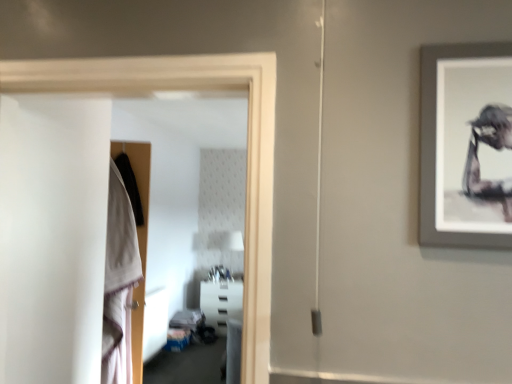
Measure the distance between point (x=249, y=152) and camera.

Point (x=249, y=152) is 1.18 meters away from camera.

Measure the distance between point (x=110, y=313) and camera.

Point (x=110, y=313) and camera are 7.36 feet apart.

The height and width of the screenshot is (384, 512). In order to click on white plastic shelf at center in this screenshot , I will do `click(221, 303)`.

The height and width of the screenshot is (384, 512). In the image, there is a white cotton robe at left. What are the coordinates of `furniture below it (from a real-world perspective)` in the screenshot? It's located at (221, 303).

Would you say white cotton robe at left is part of white plastic shelf at center's contents?

No, white plastic shelf at center does not contain white cotton robe at left.

Which object is further away from the camera, white plastic shelf at center or white cotton robe at left?

Positioned behind is white plastic shelf at center.

Is white plastic shelf at center in contact with white cotton robe at left?

No, white plastic shelf at center is not with white cotton robe at left.

Which of these two, transparent glass door at left or white plastic shelf at center, is thinner?

With smaller width is transparent glass door at left.

Consider the image. Is transparent glass door at left inside or outside of white plastic shelf at center?

transparent glass door at left is outside white plastic shelf at center.

Would you say transparent glass door at left is a long distance from white plastic shelf at center?

Yes.

Looking at this image, does transparent glass door at left have a larger size compared to white plastic shelf at center?

Incorrect, transparent glass door at left is not larger than white plastic shelf at center.

Considering the positions of objects white cotton robe at left and white plastic shelf at center in the image provided, who is more to the right, white cotton robe at left or white plastic shelf at center?

Positioned to the right is white plastic shelf at center.

From a real-world perspective, between white cotton robe at left and white plastic shelf at center, who is vertically higher?

From a 3D spatial view, white cotton robe at left is above.

Looking at the image, does white cotton robe at left seem bigger or smaller compared to white plastic shelf at center?

Clearly, white cotton robe at left is smaller in size than white plastic shelf at center.

Where is `furniture on the right side of white cotton robe at left`? The height and width of the screenshot is (384, 512). furniture on the right side of white cotton robe at left is located at coordinates (221, 303).

Considering the relative sizes of white cotton robe at left and transparent glass door at left in the image provided, is white cotton robe at left smaller than transparent glass door at left?

Correct, white cotton robe at left occupies less space than transparent glass door at left.

Considering the relative sizes of white cotton robe at left and transparent glass door at left in the image provided, is white cotton robe at left taller than transparent glass door at left?

Indeed, white cotton robe at left has a greater height compared to transparent glass door at left.

Would you say white cotton robe at left contains transparent glass door at left?

That's incorrect, transparent glass door at left is not inside white cotton robe at left.

Which of these two, white cotton robe at left or transparent glass door at left, is wider?

white cotton robe at left.

Considering the points (206, 291) and (260, 259), which point is behind, point (206, 291) or point (260, 259)?

The point (206, 291) is farther.

Is white plastic shelf at center wider or thinner than transparent glass door at left?

white plastic shelf at center is wider than transparent glass door at left.

Is white plastic shelf at center taller than transparent glass door at left?

Incorrect, the height of white plastic shelf at center is not larger of that of transparent glass door at left.

In the image, is transparent glass door at left positioned in front of or behind white cotton robe at left?

transparent glass door at left is positioned closer to the viewer than white cotton robe at left.

Who is smaller, transparent glass door at left or white cotton robe at left?

white cotton robe at left.

Is transparent glass door at left thinner than white cotton robe at left?

Yes, transparent glass door at left is thinner than white cotton robe at left.

I want to click on furniture below the white cotton robe at left (from a real-world perspective), so click(221, 303).

Locate an element on the screen. The image size is (512, 384). glass door above the white plastic shelf at center (from the image's perspective) is located at coordinates (247, 148).

Based on their spatial positions, is white cotton robe at left or white plastic shelf at center closer to transparent glass door at left?

white cotton robe at left lies closer to transparent glass door at left than the other object.

Estimate the real-world distances between objects in this image. Which object is closer to white plastic shelf at center, transparent glass door at left or white cotton robe at left?

white cotton robe at left lies closer to white plastic shelf at center than the other object.

Which object lies nearer to the anchor point white cotton robe at left, white plastic shelf at center or transparent glass door at left?

transparent glass door at left is closer to white cotton robe at left.

Estimate the real-world distances between objects in this image. Which object is further from white cotton robe at left, transparent glass door at left or white plastic shelf at center?

Based on the image, white plastic shelf at center appears to be further to white cotton robe at left.

From the image, which object appears to be nearer to white plastic shelf at center, white cotton robe at left or transparent glass door at left?

Among the two, white cotton robe at left is located nearer to white plastic shelf at center.

From the image, which object appears to be farther from transparent glass door at left, white plastic shelf at center or white cotton robe at left?

white plastic shelf at center lies further to transparent glass door at left than the other object.

At what (x,y) coordinates should I click in order to perform the action: click on robe located between transparent glass door at left and white plastic shelf at center in the depth direction. Please return your answer as a coordinate pair (x, y). The width and height of the screenshot is (512, 384). Looking at the image, I should click on (119, 282).